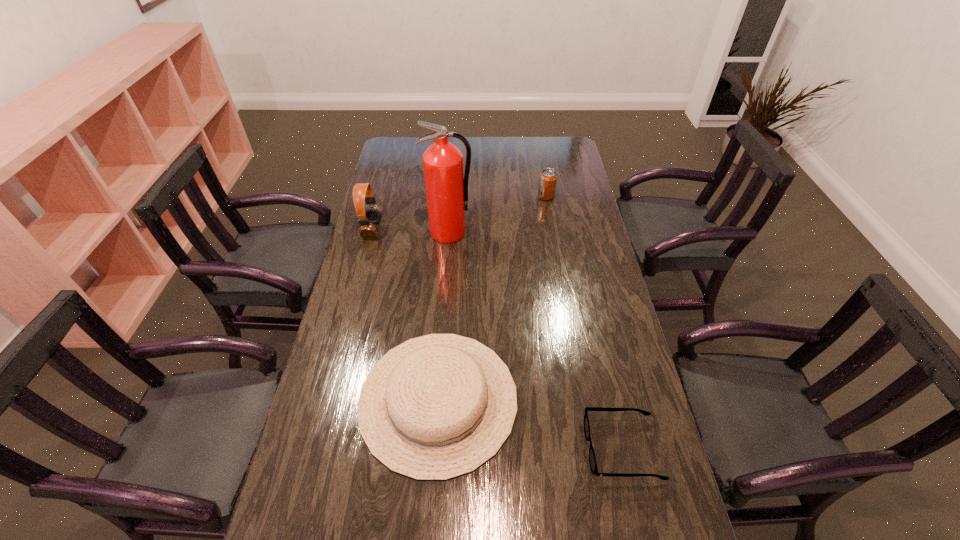
In the image, there is a desktop. At what (x,y) coordinates should I click in order to perform the action: click on free region at the right edge. Please return your answer as a coordinate pair (x, y). Looking at the image, I should click on (598, 254).

Locate an element on the screen. The height and width of the screenshot is (540, 960). vacant point at the far right corner is located at coordinates (551, 150).

In order to click on free space that is in between the soda can and the fire extinguisher in this screenshot , I will do `click(497, 214)`.

Where is `vacant space in between the shortest object and the fourth shortest object`? The image size is (960, 540). vacant space in between the shortest object and the fourth shortest object is located at coordinates (497, 339).

Where is `vacant space that's between the shortest object and the third tallest object`? vacant space that's between the shortest object and the third tallest object is located at coordinates (584, 323).

Find the location of a particular element. The width and height of the screenshot is (960, 540). free space between the shortest object and the fourth tallest object is located at coordinates (530, 424).

What are the coordinates of `empty space between the shortest object and the tallest object` in the screenshot? It's located at (536, 341).

The height and width of the screenshot is (540, 960). In order to click on blank region between the tallest object and the fourth shortest object in this screenshot , I will do `click(411, 231)`.

At what (x,y) coordinates should I click in order to perform the action: click on object that can be found as the closest to the sunhat. Please return your answer as a coordinate pair (x, y). Looking at the image, I should click on (592, 459).

Locate which object ranks fourth in proximity to the leftmost object. Please provide its 2D coordinates. Your answer should be formatted as a tuple, i.e. [(x, y)], where the tuple contains the x and y coordinates of a point satisfying the conditions above.

[(592, 459)]